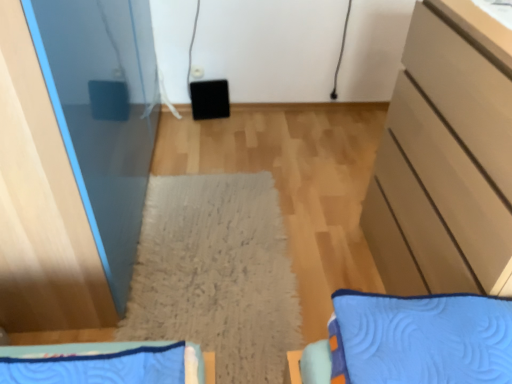
Question: From the image's perspective, is blue quilted bedspread at lower left located above or below matte beige cabinet at right?

Choices:
 (A) below
 (B) above

Answer: (A)

Question: Based on their positions, is blue quilted bedspread at lower left located to the left or right of matte beige cabinet at right?

Choices:
 (A) right
 (B) left

Answer: (B)

Question: Estimate the real-world distances between objects in this image. Which object is closer to the matte beige cabinet at right?

Choices:
 (A) blue quilted bedspread at lower left
 (B) beige textured mat at center

Answer: (B)

Question: Estimate the real-world distances between objects in this image. Which object is closer to the matte beige cabinet at right?

Choices:
 (A) blue quilted bedspread at lower left
 (B) beige textured mat at center

Answer: (B)